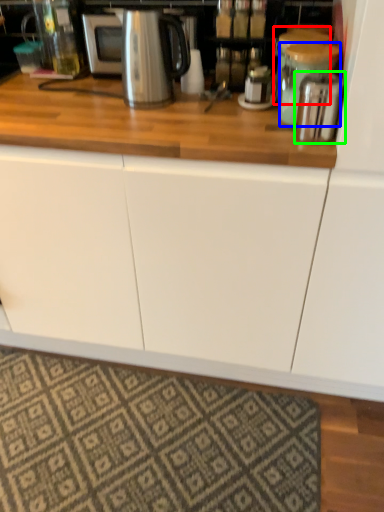
Question: Considering the real-world distances, which object is closest to appliance (highlighted by a red box)? appliance (highlighted by a blue box) or appliance (highlighted by a green box).

Choices:
 (A) appliance
 (B) appliance

Answer: (A)